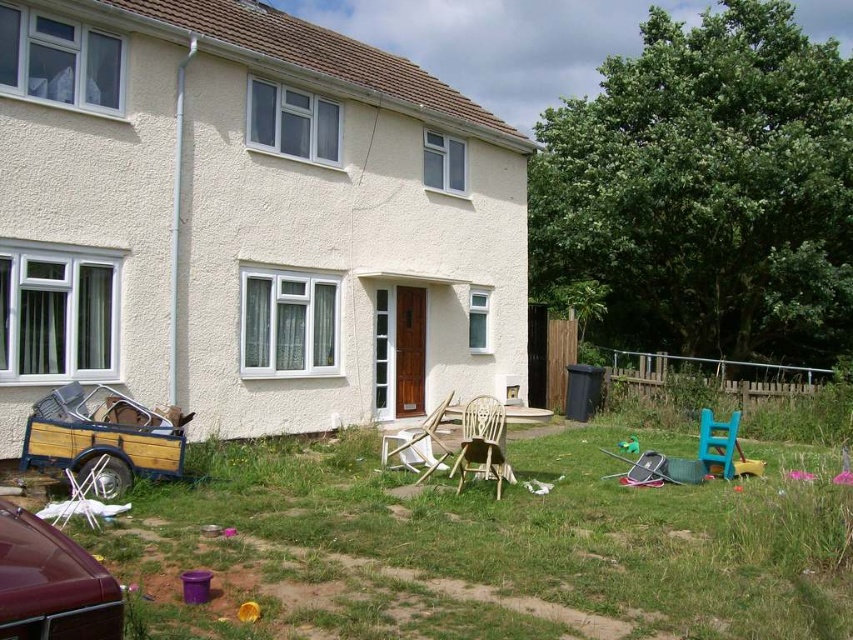
Does green grass at lower center appear over shiny maroon car at lower left?

No.

Identify the location of green grass at lower center. The height and width of the screenshot is (640, 853). (527, 532).

The height and width of the screenshot is (640, 853). In order to click on green grass at lower center in this screenshot , I will do `click(527, 532)`.

Does shiny maroon car at lower left have a lesser height compared to woven wood chair at center?

Correct, shiny maroon car at lower left is not as tall as woven wood chair at center.

Is shiny maroon car at lower left above woven wood chair at center?

Indeed, shiny maroon car at lower left is positioned over woven wood chair at center.

Describe the element at coordinates (51, 582) in the screenshot. I see `shiny maroon car at lower left` at that location.

The image size is (853, 640). I want to click on shiny maroon car at lower left, so click(51, 582).

Who is positioned more to the left, woven wood chair at center or blue plastic chair at lower right?

Positioned to the left is woven wood chair at center.

Does woven wood chair at center have a greater height compared to blue plastic chair at lower right?

Yes, woven wood chair at center is taller than blue plastic chair at lower right.

Locate an element on the screen. This screenshot has height=640, width=853. woven wood chair at center is located at coordinates (482, 444).